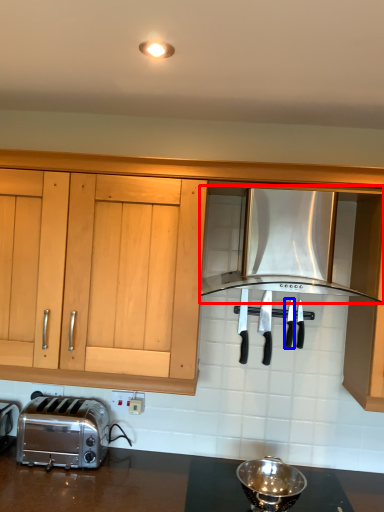
Question: Which of the following is the closest to the observer, kitchen appliance (highlighted by a red box) or silverware (highlighted by a blue box)?

Choices:
 (A) kitchen appliance
 (B) silverware

Answer: (A)